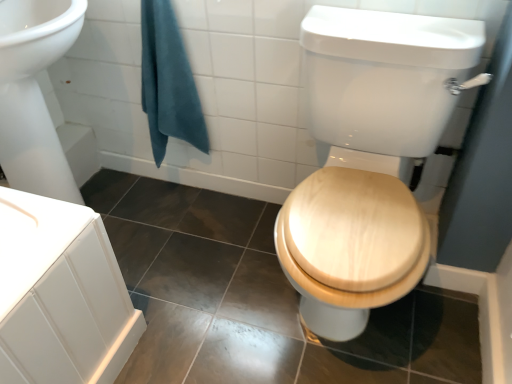
Where is `free space to the left of wooden toilet seat at center`? The width and height of the screenshot is (512, 384). free space to the left of wooden toilet seat at center is located at coordinates (203, 282).